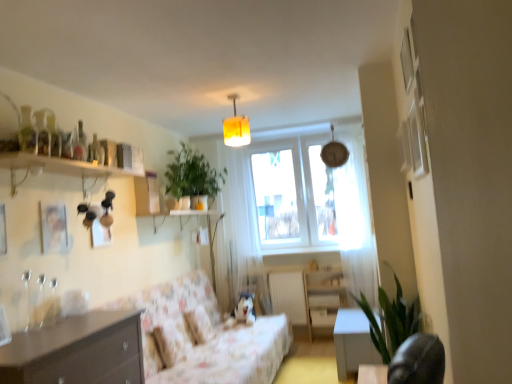
Question: From a real-world perspective, is white sheer curtain at upper right, marked as the 1th curtain in a right-to-left arrangement, positioned under green matte plant at upper center, placed as the 1th plant when sorted from back to front, based on gravity?

Choices:
 (A) yes
 (B) no

Answer: (A)

Question: Considering the relative sizes of white sheer curtain at upper right, the second curtain when ordered from back to front, and green matte plant at upper center, the 2th plant in the bottom-to-top sequence, in the image provided, is white sheer curtain at upper right, the second curtain when ordered from back to front, smaller than green matte plant at upper center, the 2th plant in the bottom-to-top sequence,?

Choices:
 (A) yes
 (B) no

Answer: (B)

Question: Is white sheer curtain at upper right, marked as the 1th curtain in a right-to-left arrangement, shorter than green matte plant at upper center, the first plant when ordered from top to bottom?

Choices:
 (A) yes
 (B) no

Answer: (B)

Question: Is white sheer curtain at upper right, marked as the 1th curtain in a right-to-left arrangement, at the left side of green matte plant at upper center, the 2th plant in the bottom-to-top sequence?

Choices:
 (A) no
 (B) yes

Answer: (A)

Question: Is white sheer curtain at upper right, the second curtain when ordered from back to front, taller than green matte plant at upper center, the first plant when ordered from top to bottom?

Choices:
 (A) no
 (B) yes

Answer: (B)

Question: Choose the correct answer: Is white glossy table at lower right inside yellow fabric lampshade at upper center or outside it?

Choices:
 (A) inside
 (B) outside

Answer: (B)

Question: Considering their positions, is white glossy table at lower right located in front of or behind yellow fabric lampshade at upper center?

Choices:
 (A) behind
 (B) front

Answer: (A)

Question: Is white glossy table at lower right to the left or to the right of yellow fabric lampshade at upper center in the image?

Choices:
 (A) left
 (B) right

Answer: (B)

Question: Considering the positions of point (373, 354) and point (244, 115), is point (373, 354) closer or farther from the camera than point (244, 115)?

Choices:
 (A) closer
 (B) farther

Answer: (A)

Question: Is wooden cabinet at lower right situated inside floral fabric couch at center or outside?

Choices:
 (A) outside
 (B) inside

Answer: (A)

Question: In the image, is wooden cabinet at lower right positioned in front of or behind floral fabric couch at center?

Choices:
 (A) front
 (B) behind

Answer: (B)

Question: Is point (330, 281) closer or farther from the camera than point (162, 377)?

Choices:
 (A) farther
 (B) closer

Answer: (A)

Question: Considering the positions of wooden cabinet at lower right and floral fabric couch at center in the image, is wooden cabinet at lower right bigger or smaller than floral fabric couch at center?

Choices:
 (A) small
 (B) big

Answer: (A)

Question: From a real-world perspective, is wooden shelf at upper left positioned above or below white sheer curtain at center, the 2th curtain viewed from the right?

Choices:
 (A) below
 (B) above

Answer: (B)

Question: In terms of height, does wooden shelf at upper left look taller or shorter compared to white sheer curtain at center, which appears as the 1th curtain when viewed from the back?

Choices:
 (A) tall
 (B) short

Answer: (B)